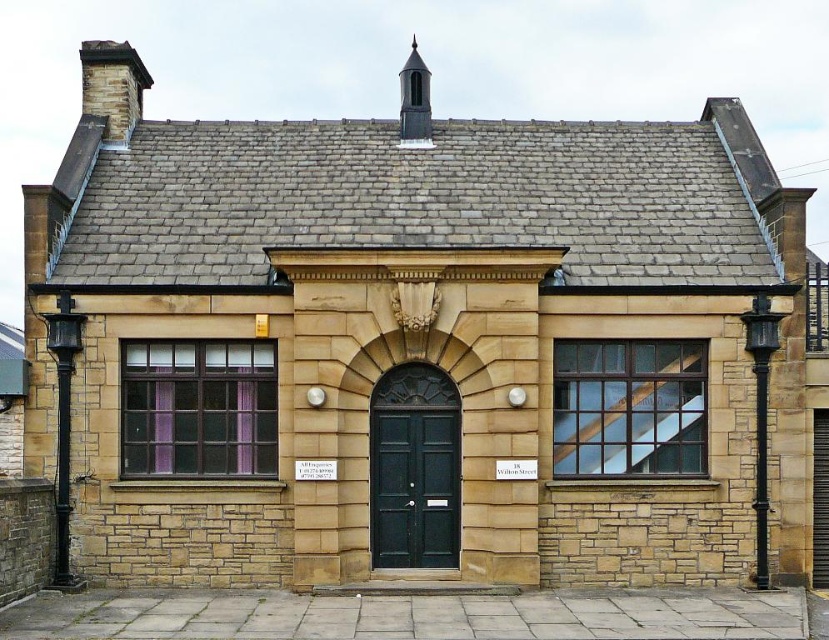
You are a firefighter assessing the building for potential hazards. You notice the brown stone chimney at upper left and the smooth gray chimney at upper center. Which chimney is located higher up on the building?

The brown stone chimney at upper left is positioned over the smooth gray chimney at upper center, meaning it is higher up on the building.

You are an architect evaluating the building for potential renovations. You notice two chimneys, the brown stone chimney at upper left and the smooth gray chimney at upper center. Which of these chimneys is bigger in size?

The brown stone chimney at upper left is larger in size compared to the smooth gray chimney at upper center.